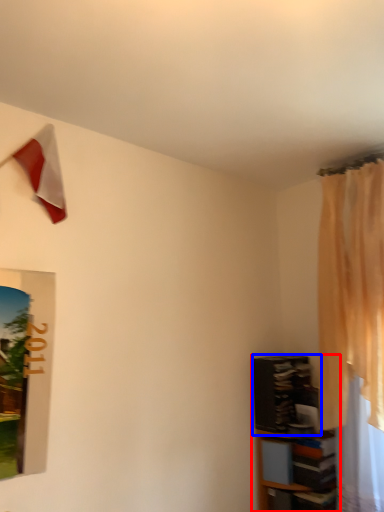
Question: Which point is closer to the camera, shelf (highlighted by a red box) or shelf (highlighted by a blue box)?

Choices:
 (A) shelf
 (B) shelf

Answer: (A)